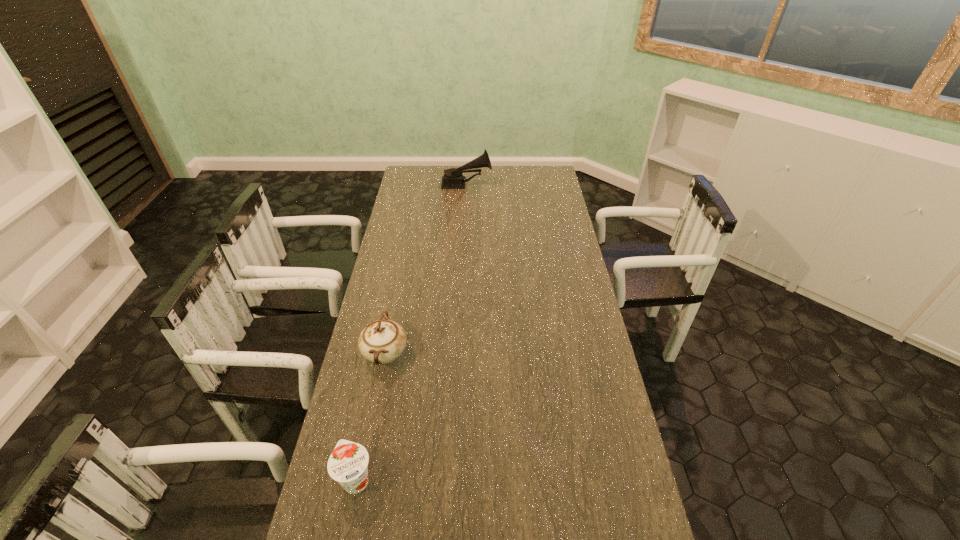
The width and height of the screenshot is (960, 540). Find the location of `blank region between the shortest object and the phonograph_record`. blank region between the shortest object and the phonograph_record is located at coordinates (412, 332).

Identify which object is the closest to the nearest object. Please provide its 2D coordinates. Your answer should be formatted as a tuple, i.e. [(x, y)], where the tuple contains the x and y coordinates of a point satisfying the conditions above.

[(382, 341)]

The width and height of the screenshot is (960, 540). In order to click on the closest object to the second nearest object in this screenshot , I will do `click(348, 462)`.

Find the location of a particular element. This screenshot has height=540, width=960. vacant space that satisfies the following two spatial constraints: 1. from the horn of the tallest object; 2. on the front side of the yogurt is located at coordinates (453, 480).

Identify the location of vacant region that satisfies the following two spatial constraints: 1. from the horn of the farthest object; 2. on the front side of the second farthest object. (459, 354).

Find the location of a particular element. free space that satisfies the following two spatial constraints: 1. from the horn of the phonograph_record; 2. on the front side of the yogurt is located at coordinates (453, 480).